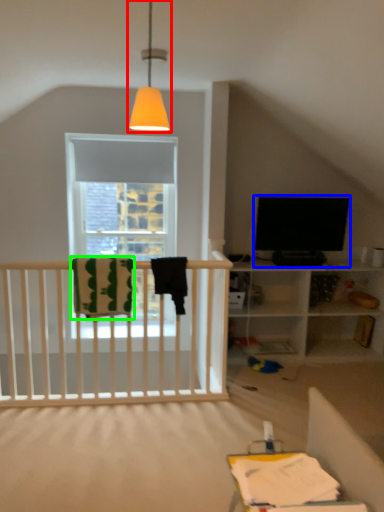
Question: Considering the real-world distances, which object is closest to lamp (highlighted by a red box)? television (highlighted by a blue box) or blanket (highlighted by a green box).

Choices:
 (A) television
 (B) blanket

Answer: (B)